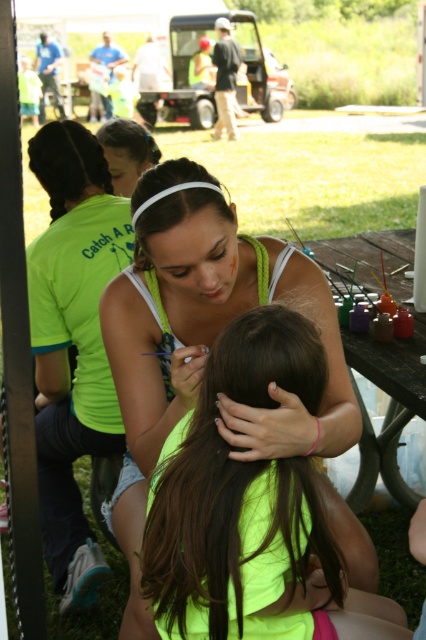
Does wooden picnic table at center have a larger size compared to white matte headband at center?

Yes.

Between point (391, 372) and point (147, 193), which one is positioned behind?

The point (391, 372) is behind.

Identify the location of wooden picnic table at center. (389, 406).

Between point (158, 602) and point (138, 163), which one is positioned behind?

Positioned behind is point (138, 163).

Which is in front, point (236, 380) or point (147, 150)?

Point (236, 380) is in front.

Identify the location of brown smooth hair at center. This screenshot has height=640, width=426. (238, 496).

What do you see at coordinates (389, 406) in the screenshot? I see `wooden picnic table at center` at bounding box center [389, 406].

Between wooden picnic table at center and braided dark brown hair at upper left, which one appears on the left side from the viewer's perspective?

From the viewer's perspective, braided dark brown hair at upper left appears more on the left side.

Is point (425, 339) closer to camera compared to point (75, 152)?

Yes, it is in front of point (75, 152).

Where is `wooden picnic table at center`? wooden picnic table at center is located at coordinates (389, 406).